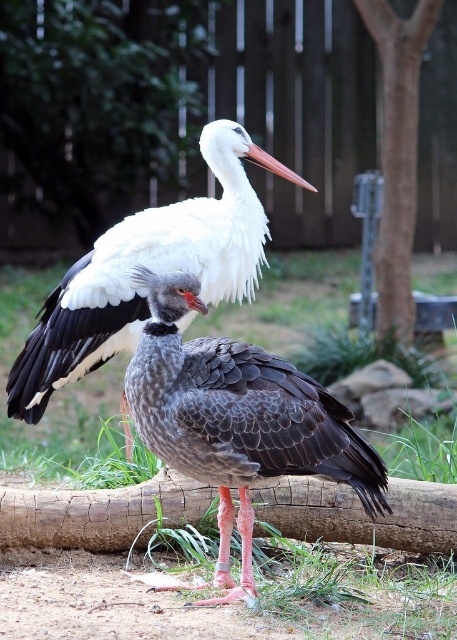
This screenshot has width=457, height=640. Find the location of `gray matte feathers at center`. gray matte feathers at center is located at coordinates (237, 419).

Is gray matte feathers at center behind white feathered stork at upper center?

No, it is in front of white feathered stork at upper center.

Is point (366, 509) farther from viewer compared to point (38, 376)?

No.

The width and height of the screenshot is (457, 640). What are the coordinates of `gray matte feathers at center` in the screenshot? It's located at (237, 419).